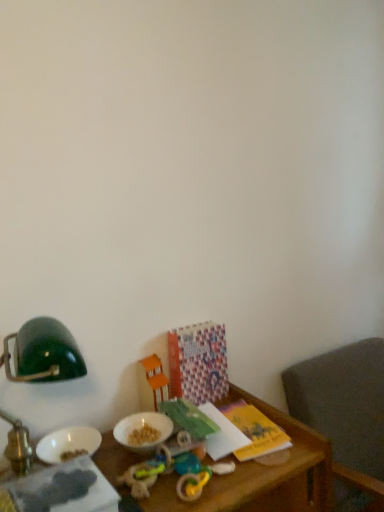
Where is `orange plastic toy house at center, the third toy viewed from the front`? This screenshot has height=512, width=384. orange plastic toy house at center, the third toy viewed from the front is located at coordinates (152, 382).

You are a GUI agent. You are given a task and a screenshot of the screen. Output one action in this format:
    pyautogui.click(x=<x>, y=<y>)
    Task: Click on the matte green book at lower left, marked as the 1th book in a left-to-right arrangement
    The height and width of the screenshot is (512, 384).
    Given the screenshot: What is the action you would take?
    pyautogui.click(x=64, y=489)

Describe the element at coordinates (146, 474) in the screenshot. The width and height of the screenshot is (384, 512). I see `rubber chew toy at lower center, acting as the second toy starting from the back` at that location.

Find the location of a particular element. rubber chew toy at lower center, acting as the second toy starting from the back is located at coordinates (146, 474).

Image resolution: width=384 pixels, height=512 pixels. What do you see at coordinates (200, 480) in the screenshot?
I see `rubber teething ring at lower center, the first toy when ordered from front to back` at bounding box center [200, 480].

Describe the element at coordinates (261, 476) in the screenshot. I see `wooden table at lower left` at that location.

In the scene shown: What is the approximate width of wooden table at lower left?

The width of wooden table at lower left is 46.63 centimeters.

What do you see at coordinates (198, 362) in the screenshot? This screenshot has width=384, height=512. I see `patterned paper calendar at lower center, the 1th book from the right` at bounding box center [198, 362].

Identify the location of orange plastic toy house at center, the third toy viewed from the front. point(152,382).

Can you tell me how much orange plastic toy house at center, which is the 1th toy from back to front, and green matte lampshade at upper left differ in facing direction?

The angular difference between orange plastic toy house at center, which is the 1th toy from back to front, and green matte lampshade at upper left is 0.42 degrees.

Can you confirm if orange plastic toy house at center, the third toy viewed from the front, is thinner than green matte lampshade at upper left?

Yes, orange plastic toy house at center, the third toy viewed from the front, is thinner than green matte lampshade at upper left.

From the image's perspective, which one is positioned lower, orange plastic toy house at center, which is the 1th toy from back to front, or green matte lampshade at upper left?

orange plastic toy house at center, which is the 1th toy from back to front, appears lower in the image.

Between point (144, 364) and point (58, 337), which one is positioned behind?

The point (144, 364) is behind.

This screenshot has width=384, height=512. I want to click on book on the left of the patterned paper calendar at lower center, which is the 2th book from front to back, so (64, 489).

Is matte green book at lower left, marked as the 1th book in a left-to-right arrangement, inside or outside of patterned paper calendar at lower center, the 1th book from the right?

matte green book at lower left, marked as the 1th book in a left-to-right arrangement, is outside patterned paper calendar at lower center, the 1th book from the right.

Is matte green book at lower left, which ranks as the second book in back-to-front order, bigger than patterned paper calendar at lower center, the 1th book from the right?

Correct, matte green book at lower left, which ranks as the second book in back-to-front order, is larger in size than patterned paper calendar at lower center, the 1th book from the right.

Is matte green book at lower left, marked as the 1th book in a left-to-right arrangement, thinner than patterned paper calendar at lower center, the 1th book from the right?

No.

Is orange plastic toy house at center, the third toy viewed from the front, aimed at gray fabric chair at lower right?

No, orange plastic toy house at center, the third toy viewed from the front, is not turned towards gray fabric chair at lower right.

Are orange plastic toy house at center, the third toy viewed from the front, and gray fabric chair at lower right far apart?

No, there isn't a large distance between orange plastic toy house at center, the third toy viewed from the front, and gray fabric chair at lower right.

Does orange plastic toy house at center, the third toy viewed from the front, contain gray fabric chair at lower right?

No, orange plastic toy house at center, the third toy viewed from the front, does not contain gray fabric chair at lower right.

This screenshot has height=512, width=384. In order to click on the 3rd toy to the right of the matte green book at lower left, the 1th book from the front, counting from the anchor's position in this screenshot , I will do `click(200, 480)`.

Looking at this image, considering the sizes of matte green book at lower left, which ranks as the second book in back-to-front order, and rubber teething ring at lower center, which is counted as the 3th toy, starting from the back, in the image, is matte green book at lower left, which ranks as the second book in back-to-front order, taller or shorter than rubber teething ring at lower center, which is counted as the 3th toy, starting from the back,?

Considering their sizes, matte green book at lower left, which ranks as the second book in back-to-front order, has more height than rubber teething ring at lower center, which is counted as the 3th toy, starting from the back.

Is matte green book at lower left, marked as the 1th book in a left-to-right arrangement, aimed at rubber teething ring at lower center, which is counted as the 3th toy, starting from the back?

No.

From the image's perspective, between matte green book at lower left, the 1th book from the front, and rubber teething ring at lower center, which is counted as the 3th toy, starting from the back, who is located below?

rubber teething ring at lower center, which is counted as the 3th toy, starting from the back.

Considering the sizes of objects patterned paper calendar at lower center, acting as the 1th book starting from the back, and orange plastic toy house at center, the third toy viewed from the front, in the image provided, who is smaller, patterned paper calendar at lower center, acting as the 1th book starting from the back, or orange plastic toy house at center, the third toy viewed from the front,?

With smaller size is orange plastic toy house at center, the third toy viewed from the front.

From a real-world perspective, is patterned paper calendar at lower center, the 1th book from the right, positioned above or below orange plastic toy house at center, which is the 1th toy from back to front?

In terms of real-world spatial position, patterned paper calendar at lower center, the 1th book from the right, is above orange plastic toy house at center, which is the 1th toy from back to front.

Does point (191, 341) appear closer or farther from the camera than point (164, 395)?

Point (191, 341) is farther from the camera than point (164, 395).

Measure the distance from patterned paper calendar at lower center, acting as the 1th book starting from the back, to orange plastic toy house at center, the third toy viewed from the front.

A distance of 4.11 inches exists between patterned paper calendar at lower center, acting as the 1th book starting from the back, and orange plastic toy house at center, the third toy viewed from the front.

Considering the positions of objects patterned paper calendar at lower center, the 1th book from the right, and wooden table at lower left in the image provided, who is more to the right, patterned paper calendar at lower center, the 1th book from the right, or wooden table at lower left?

patterned paper calendar at lower center, the 1th book from the right.

Is patterned paper calendar at lower center, the 1th book from the right, thinner than wooden table at lower left?

Indeed, patterned paper calendar at lower center, the 1th book from the right, has a lesser width compared to wooden table at lower left.

Is patterned paper calendar at lower center, which is the 2th book from front to back, facing away from wooden table at lower left?

No, wooden table at lower left is not at the back of patterned paper calendar at lower center, which is the 2th book from front to back.

Considering their positions, is patterned paper calendar at lower center, which is the 2th book from front to back, located in front of or behind wooden table at lower left?

patterned paper calendar at lower center, which is the 2th book from front to back, is behind wooden table at lower left.

Is gray fabric chair at lower right surrounding orange plastic toy house at center, the third toy viewed from the front?

No, orange plastic toy house at center, the third toy viewed from the front, is not surrounded by gray fabric chair at lower right.

Does gray fabric chair at lower right have a greater height compared to orange plastic toy house at center, which is the 1th toy from back to front?

Yes.

Based on the photo, considering the sizes of gray fabric chair at lower right and orange plastic toy house at center, which is the 1th toy from back to front, in the image, is gray fabric chair at lower right bigger or smaller than orange plastic toy house at center, which is the 1th toy from back to front,?

Considering their sizes, gray fabric chair at lower right takes up more space than orange plastic toy house at center, which is the 1th toy from back to front.

From a real-world perspective, count 1st toys downward from the green matte lampshade at upper left and point to it. Please provide its 2D coordinates.

[(152, 382)]

Locate an element on the screen. book that appears in front of the patterned paper calendar at lower center, the 1th book from the right is located at coordinates (64, 489).

Based on their spatial positions, is gray fabric chair at lower right or orange plastic toy house at center, which is the 1th toy from back to front, closer to patterned paper calendar at lower center, which is the 2th book from front to back?

orange plastic toy house at center, which is the 1th toy from back to front, is closer to patterned paper calendar at lower center, which is the 2th book from front to back.

Considering their positions, is rubber teething ring at lower center, the first toy when ordered from front to back, positioned closer to gray fabric chair at lower right than wooden table at lower left?

wooden table at lower left.

Considering their positions, is patterned paper calendar at lower center, acting as the 1th book starting from the back, positioned further to rubber teething ring at lower center, the first toy when ordered from front to back, than wooden table at lower left?

patterned paper calendar at lower center, acting as the 1th book starting from the back, is positioned further to the anchor rubber teething ring at lower center, the first toy when ordered from front to back.

When comparing their distances from patterned paper calendar at lower center, which is the 2th book from front to back, does green matte lampshade at upper left or orange plastic toy house at center, the third toy viewed from the front, seem closer?

The object closer to patterned paper calendar at lower center, which is the 2th book from front to back, is orange plastic toy house at center, the third toy viewed from the front.

From the image, which object appears to be nearer to green matte lampshade at upper left, orange plastic toy house at center, which is the 1th toy from back to front, or rubber chew toy at lower center, acting as the second toy starting from the back?

rubber chew toy at lower center, acting as the second toy starting from the back, is positioned closer to the anchor green matte lampshade at upper left.

When comparing their distances from patterned paper calendar at lower center, which is the 2th book from front to back, does gray fabric chair at lower right or rubber teething ring at lower center, which is counted as the 3th toy, starting from the back, seem further?

gray fabric chair at lower right is positioned further to the anchor patterned paper calendar at lower center, which is the 2th book from front to back.

Based on their spatial positions, is green matte lampshade at upper left or matte green book at lower left, marked as the 1th book in a left-to-right arrangement, closer to rubber teething ring at lower center, the first toy when ordered from front to back?

Among the two, matte green book at lower left, marked as the 1th book in a left-to-right arrangement, is located nearer to rubber teething ring at lower center, the first toy when ordered from front to back.

Looking at this image, when comparing their distances from wooden table at lower left, does orange plastic toy house at center, the third toy viewed from the front, or patterned paper calendar at lower center, arranged as the second book when viewed from the left, seem further?

Based on the image, orange plastic toy house at center, the third toy viewed from the front, appears to be further to wooden table at lower left.

You are a GUI agent. You are given a task and a screenshot of the screen. Output one action in this format:
    pyautogui.click(x=<x>, y=<y>)
    Task: Click on the book between orange plastic toy house at center, the third toy viewed from the front, and gray fabric chair at lower right, in the horizontal direction
    
    Given the screenshot: What is the action you would take?
    click(x=198, y=362)

I want to click on table between orange plastic toy house at center, the third toy viewed from the front, and gray fabric chair at lower right from left to right, so click(x=261, y=476).

Where is `book situated between matte green book at lower left, the 1th book from the front, and gray fabric chair at lower right from left to right`? The image size is (384, 512). book situated between matte green book at lower left, the 1th book from the front, and gray fabric chair at lower right from left to right is located at coordinates (198, 362).

The width and height of the screenshot is (384, 512). What are the coordinates of `toy between matte green book at lower left, marked as the 1th book in a left-to-right arrangement, and rubber chew toy at lower center, acting as the second toy starting from the back, along the z-axis` in the screenshot? It's located at (200, 480).